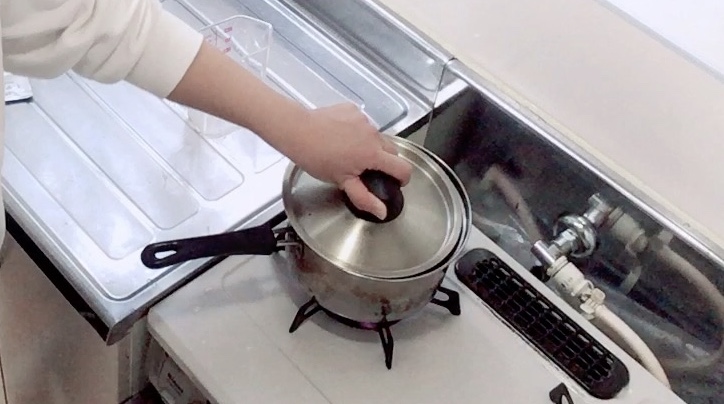
At what (x,y) coordinates should I click in order to perform the action: click on plastic cup. Please return your answer as a coordinate pair (x, y). The height and width of the screenshot is (404, 724). Looking at the image, I should click on (256, 56).